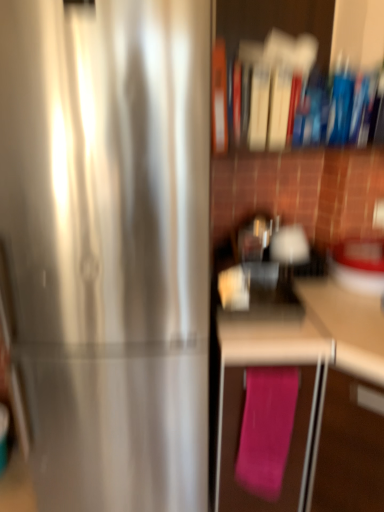
Question: Can you confirm if pink fabric at lower right is shorter than pink fabric bath towel at lower right?

Choices:
 (A) no
 (B) yes

Answer: (A)

Question: Considering the relative positions of pink fabric at lower right and pink fabric bath towel at lower right in the image provided, is pink fabric at lower right to the right of pink fabric bath towel at lower right from the viewer's perspective?

Choices:
 (A) no
 (B) yes

Answer: (B)

Question: Are pink fabric at lower right and pink fabric bath towel at lower right located far from each other?

Choices:
 (A) no
 (B) yes

Answer: (A)

Question: From a real-world perspective, is pink fabric at lower right positioned under pink fabric bath towel at lower right based on gravity?

Choices:
 (A) yes
 (B) no

Answer: (A)

Question: Is pink fabric at lower right bigger than pink fabric bath towel at lower right?

Choices:
 (A) yes
 (B) no

Answer: (A)

Question: Considering the positions of satin silver refrigerator at left and pink fabric at lower right in the image, is satin silver refrigerator at left wider or thinner than pink fabric at lower right?

Choices:
 (A) wide
 (B) thin

Answer: (B)

Question: From the image's perspective, relative to pink fabric at lower right, is satin silver refrigerator at left above or below?

Choices:
 (A) above
 (B) below

Answer: (A)

Question: Visually, is satin silver refrigerator at left positioned to the left or to the right of pink fabric at lower right?

Choices:
 (A) left
 (B) right

Answer: (A)

Question: In terms of size, does satin silver refrigerator at left appear bigger or smaller than pink fabric at lower right?

Choices:
 (A) small
 (B) big

Answer: (A)

Question: Is pink fabric at lower right taller or shorter than pink fabric bath towel at lower right?

Choices:
 (A) short
 (B) tall

Answer: (B)

Question: From the image's perspective, is pink fabric at lower right positioned above or below pink fabric bath towel at lower right?

Choices:
 (A) below
 (B) above

Answer: (A)

Question: Which is correct: pink fabric at lower right is inside pink fabric bath towel at lower right, or outside of it?

Choices:
 (A) inside
 (B) outside

Answer: (B)

Question: Is pink fabric at lower right wider or thinner than pink fabric bath towel at lower right?

Choices:
 (A) wide
 (B) thin

Answer: (A)

Question: Is point click(91, 30) closer or farther from the camera than point click(266, 373)?

Choices:
 (A) farther
 (B) closer

Answer: (B)

Question: Based on their positions, is satin silver refrigerator at left located to the left or right of pink fabric bath towel at lower right?

Choices:
 (A) right
 (B) left

Answer: (B)